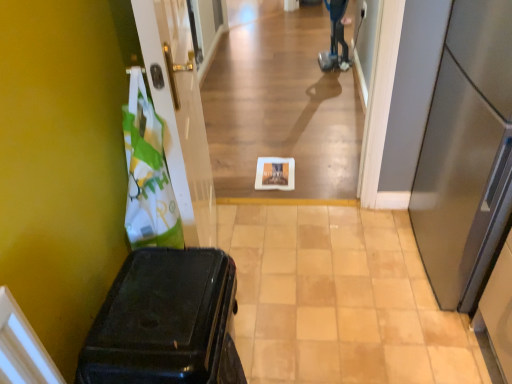
At what (x,y) coordinates should I click in order to perform the action: click on free space between blue plastic mobility scooter at upper center and white paper at center. Please return your answer as a coordinate pair (x, y). Looking at the image, I should click on (312, 124).